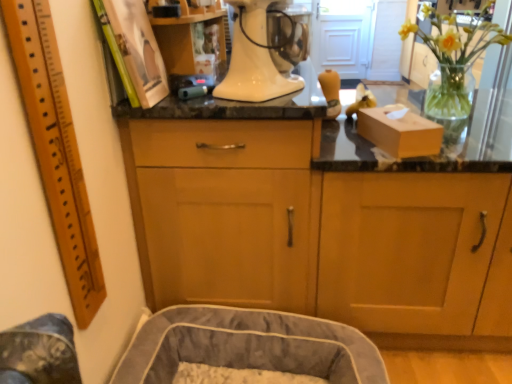
Question: From the image's perspective, is wooden cabinet at center, acting as the first cabinetry starting from the right, under matte cardboard box at right?

Choices:
 (A) no
 (B) yes

Answer: (B)

Question: Considering the relative sizes of wooden cabinet at center, acting as the 2th cabinetry starting from the left, and matte cardboard box at right in the image provided, is wooden cabinet at center, acting as the 2th cabinetry starting from the left, taller than matte cardboard box at right?

Choices:
 (A) no
 (B) yes

Answer: (B)

Question: Considering the relative sizes of wooden cabinet at center, acting as the 2th cabinetry starting from the left, and matte cardboard box at right in the image provided, is wooden cabinet at center, acting as the 2th cabinetry starting from the left, shorter than matte cardboard box at right?

Choices:
 (A) no
 (B) yes

Answer: (A)

Question: Would you say wooden cabinet at center, acting as the 2th cabinetry starting from the left, is outside matte cardboard box at right?

Choices:
 (A) yes
 (B) no

Answer: (A)

Question: Considering the relative sizes of wooden cabinet at center, acting as the 2th cabinetry starting from the left, and matte cardboard box at right in the image provided, is wooden cabinet at center, acting as the 2th cabinetry starting from the left, smaller than matte cardboard box at right?

Choices:
 (A) no
 (B) yes

Answer: (A)

Question: Is wooden cabinet at center, acting as the 2th cabinetry starting from the left, oriented towards matte cardboard box at right?

Choices:
 (A) no
 (B) yes

Answer: (A)

Question: From the image's perspective, is soft gray fabric dog bed at lower left under wooden cabinet at center, acting as the first cabinetry starting from the right?

Choices:
 (A) no
 (B) yes

Answer: (B)

Question: Is soft gray fabric dog bed at lower left smaller than wooden cabinet at center, acting as the 2th cabinetry starting from the left?

Choices:
 (A) no
 (B) yes

Answer: (B)

Question: Can you see soft gray fabric dog bed at lower left touching wooden cabinet at center, acting as the first cabinetry starting from the right?

Choices:
 (A) no
 (B) yes

Answer: (A)

Question: Is wooden cabinet at center, acting as the first cabinetry starting from the right, a part of soft gray fabric dog bed at lower left?

Choices:
 (A) no
 (B) yes

Answer: (A)

Question: Is soft gray fabric dog bed at lower left far from wooden cabinet at center, acting as the 2th cabinetry starting from the left?

Choices:
 (A) no
 (B) yes

Answer: (A)

Question: Considering the relative sizes of soft gray fabric dog bed at lower left and wooden cabinet at center, acting as the first cabinetry starting from the right, in the image provided, is soft gray fabric dog bed at lower left wider than wooden cabinet at center, acting as the first cabinetry starting from the right,?

Choices:
 (A) no
 (B) yes

Answer: (A)

Question: From a real-world perspective, is wooden ruler at left on white glossy stand mixer at center?

Choices:
 (A) yes
 (B) no

Answer: (B)